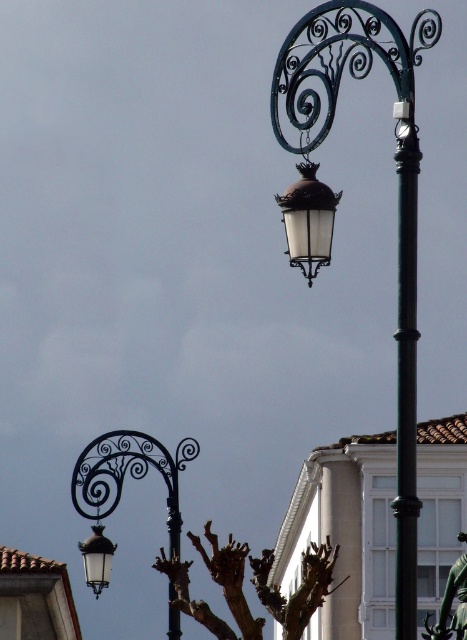
Which is below, bare branches at center or matte black lantern at lower left?

bare branches at center is lower down.

Is bare branches at center above matte black lantern at lower left?

No.

Image resolution: width=467 pixels, height=640 pixels. Identify the location of bare branches at center. (297, 588).

Find the location of a particular element. bare branches at center is located at coordinates (297, 588).

In the scene shown: Can you confirm if black metal pole at upper right is shorter than matte black lantern at center?

No.

Does black metal pole at upper right appear under matte black lantern at center?

Correct, black metal pole at upper right is located below matte black lantern at center.

Is point (398, 280) closer to viewer compared to point (331, 240)?

Yes, it is in front of point (331, 240).

Identify the location of black metal pole at upper right. (407, 371).

How far apart are black metal pole at upper right and brown/dried wood branches at lower center?

black metal pole at upper right and brown/dried wood branches at lower center are 18.43 meters apart from each other.

Image resolution: width=467 pixels, height=640 pixels. What do you see at coordinates (407, 371) in the screenshot?
I see `black metal pole at upper right` at bounding box center [407, 371].

Which is behind, point (409, 220) or point (243, 573)?

Positioned behind is point (243, 573).

This screenshot has width=467, height=640. What are the coordinates of `black metal pole at upper right` in the screenshot? It's located at (407, 371).